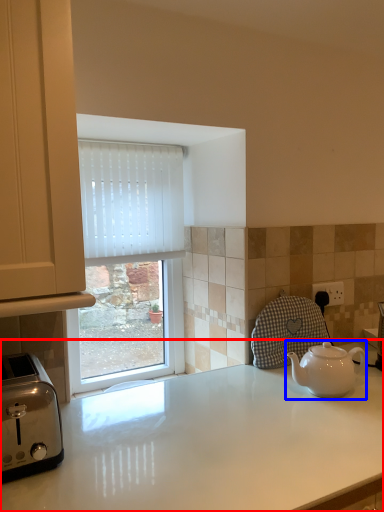
Question: Which object is closer to the camera taking this photo, countertop (highlighted by a red box) or kettle (highlighted by a blue box)?

Choices:
 (A) countertop
 (B) kettle

Answer: (A)